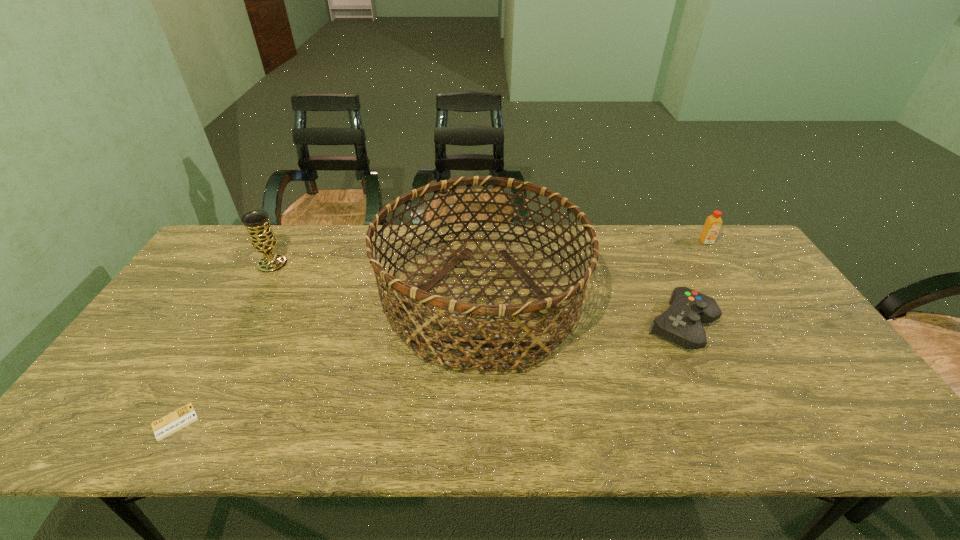
Find the location of a particular element. Image resolution: width=960 pixels, height=540 pixels. free region at the far edge of the desktop is located at coordinates (662, 241).

You are a GUI agent. You are given a task and a screenshot of the screen. Output one action in this format:
    pyautogui.click(x=<x>, y=<y>)
    Task: Click on the vacant space at the near edge of the desktop
    
    Given the screenshot: What is the action you would take?
    pyautogui.click(x=312, y=434)

Find the location of a particular element. This screenshot has width=960, height=540. vacant space at the left edge is located at coordinates (163, 368).

Where is `vacant space at the right edge`? vacant space at the right edge is located at coordinates (797, 353).

At what (x,y) coordinates should I click in order to perform the action: click on vacant space at the far left corner. Please return your answer as a coordinate pair (x, y). This screenshot has height=540, width=960. Looking at the image, I should click on (226, 269).

This screenshot has width=960, height=540. What are the coordinates of `free space at the near left corner of the desktop` in the screenshot? It's located at (140, 414).

The image size is (960, 540). Identify the location of empty location between the tallest object and the second tallest object. (377, 282).

Identify the location of free space between the chalice and the nearest object. The width and height of the screenshot is (960, 540). (224, 343).

Find the location of a particular element. vacant area between the second shortest object and the nearest object is located at coordinates (428, 374).

Find the location of a particular element. The height and width of the screenshot is (540, 960). free spot between the basket and the second tallest object is located at coordinates (377, 282).